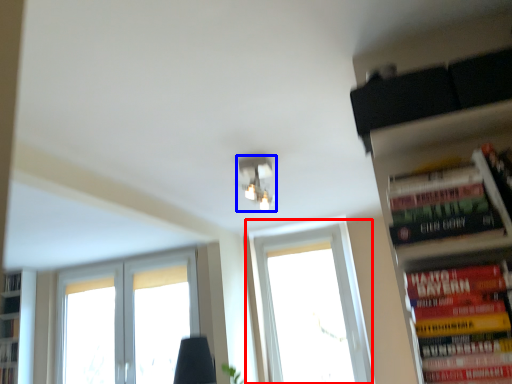
Question: Which object appears farthest to the camera in this image, window (highlighted by a red box) or light fixture (highlighted by a blue box)?

Choices:
 (A) window
 (B) light fixture

Answer: (A)